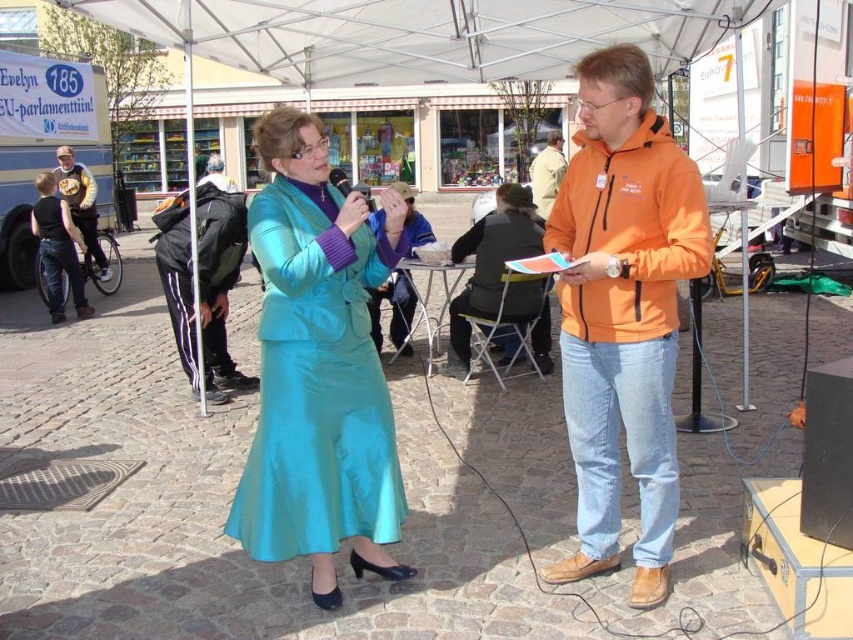
Is orange fleece jacket at right smaller than blue denim jacket at center?

Indeed, orange fleece jacket at right has a smaller size compared to blue denim jacket at center.

Is orange fleece jacket at right positioned at the back of blue denim jacket at center?

No, it is not.

Who is more distant from viewer, [664,208] or [403,225]?

The point [403,225] is more distant.

Where is `orange fleece jacket at right`? This screenshot has width=853, height=640. orange fleece jacket at right is located at coordinates (630, 232).

Is point (407, 253) positioned after point (77, 163)?

No, (407, 253) is in front of (77, 163).

Can you confirm if blue denim jacket at center is smaller than yellow leather jacket at left?

No, blue denim jacket at center is not smaller than yellow leather jacket at left.

Does point (374, 321) come closer to viewer compared to point (80, 212)?

Yes.

This screenshot has height=640, width=853. I want to click on blue denim jacket at center, so click(393, 310).

From the picture: Who is positioned more to the right, orange fleece jacket at center or orange fleece jacket at upper right?

orange fleece jacket at upper right is more to the right.

Between orange fleece jacket at center and orange fleece jacket at upper right, which one appears on the left side from the viewer's perspective?

From the viewer's perspective, orange fleece jacket at center appears more on the left side.

Describe the element at coordinates (624, 310) in the screenshot. I see `orange fleece jacket at center` at that location.

Where is `orange fleece jacket at center`? This screenshot has height=640, width=853. orange fleece jacket at center is located at coordinates (624, 310).